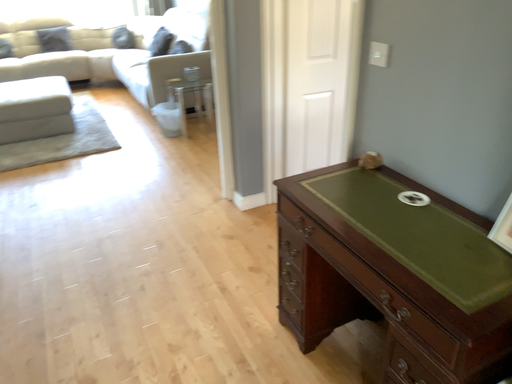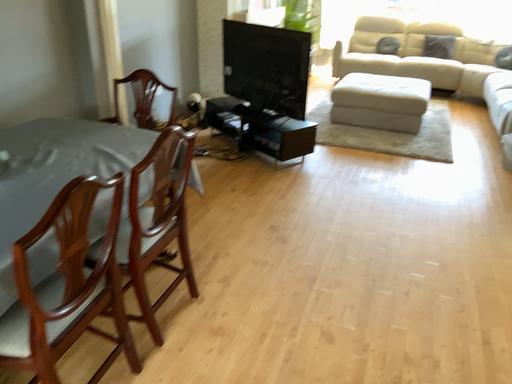
Question: How did the camera likely rotate when shooting the video?

Choices:
 (A) rotated downward
 (B) rotated upward

Answer: (B)